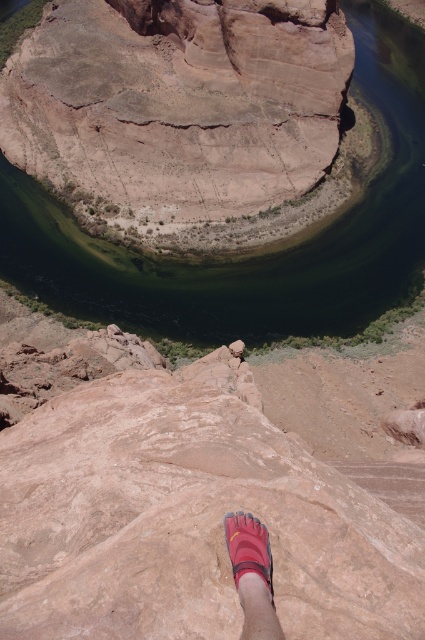
Question: Can you confirm if dark green water at center is positioned below pink fabric foot at lower center?

Choices:
 (A) no
 (B) yes

Answer: (A)

Question: Observing the image, what is the correct spatial positioning of dark green water at center in reference to pink fabric foot at lower center?

Choices:
 (A) above
 (B) below

Answer: (A)

Question: Which of the following is the closest to the observer?

Choices:
 (A) (269, 572)
 (B) (342, 250)

Answer: (A)

Question: Which of the following is the closest to the observer?

Choices:
 (A) dark green water at center
 (B) pink fabric foot at lower center

Answer: (B)

Question: Is dark green water at center above pink fabric foot at lower center?

Choices:
 (A) yes
 (B) no

Answer: (A)

Question: Which of the following is the farthest from the observer?

Choices:
 (A) (266, 580)
 (B) (286, 323)

Answer: (B)